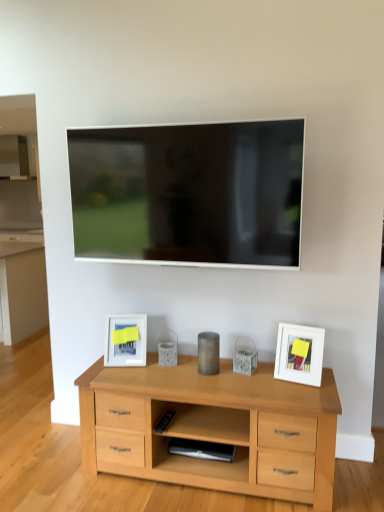
The image size is (384, 512). Identify the location of matte black tv at upper center. (189, 193).

This screenshot has width=384, height=512. Describe the element at coordinates (299, 354) in the screenshot. I see `white matte picture frame at right, the first picture frame when ordered from right to left` at that location.

Locate an element on the screen. satin black speaker at lower center, the 1th appliance when ordered from bottom to top is located at coordinates (202, 449).

I want to click on matte black tv at upper center, so click(189, 193).

How different are the orientations of satin black speaker at lower center, the 2th appliance from the top, and white matte picture frame at lower left, which ranks as the 1th picture frame in left-to-right order, in degrees?

There is a 14.4-degree angle between the facing directions of satin black speaker at lower center, the 2th appliance from the top, and white matte picture frame at lower left, which ranks as the 1th picture frame in left-to-right order.

Is satin black speaker at lower center, the 1th appliance when ordered from bottom to top, oriented towards white matte picture frame at lower left, which ranks as the 1th picture frame in left-to-right order?

No.

Is satin black speaker at lower center, the 2th appliance from the top, shorter than white matte picture frame at lower left, marked as the 2th picture frame in a front-to-back arrangement?

Indeed, satin black speaker at lower center, the 2th appliance from the top, has a lesser height compared to white matte picture frame at lower left, marked as the 2th picture frame in a front-to-back arrangement.

From a real-world perspective, which object stands above the other?

white matte picture frame at lower left, which appears as the first picture frame when viewed from the back, from a real-world perspective.

Considering the sizes of objects white matte picture frame at lower left, the 2th picture frame in the right-to-left sequence, and matte black tv at upper center in the image provided, who is shorter, white matte picture frame at lower left, the 2th picture frame in the right-to-left sequence, or matte black tv at upper center?

white matte picture frame at lower left, the 2th picture frame in the right-to-left sequence.

Between white matte picture frame at lower left, the 2th picture frame in the right-to-left sequence, and matte black tv at upper center, which one appears on the right side from the viewer's perspective?

From the viewer's perspective, matte black tv at upper center appears more on the right side.

From a real-world perspective, is white matte picture frame at lower left, the 2th picture frame in the right-to-left sequence, on top of matte black tv at upper center?

No, from a real-world perspective, white matte picture frame at lower left, the 2th picture frame in the right-to-left sequence, is not on top of matte black tv at upper center.

Is white matte picture frame at lower left, which ranks as the 1th picture frame in left-to-right order, bigger than matte black tv at upper center?

Incorrect, white matte picture frame at lower left, which ranks as the 1th picture frame in left-to-right order, is not larger than matte black tv at upper center.

What's the angular difference between metallic cylinder at center, the first appliance from the top, and matte black tv at upper center's facing directions?

They differ by 4.69 degrees in their facing directions.

Is metallic cylinder at center, the first appliance from the top, positioned before matte black tv at upper center?

No, metallic cylinder at center, the first appliance from the top, is further to the viewer.

Could you tell me if metallic cylinder at center, marked as the second appliance in a bottom-to-top arrangement, is facing matte black tv at upper center?

No, metallic cylinder at center, marked as the second appliance in a bottom-to-top arrangement, does not turn towards matte black tv at upper center.

Considering the points (216, 453) and (197, 187), which point is in front, point (216, 453) or point (197, 187)?

The point (197, 187) is in front.

What's the angular difference between satin black speaker at lower center, the 1th appliance when ordered from bottom to top, and matte black tv at upper center's facing directions?

They differ by 2.42 degrees in their facing directions.

From a real-world perspective, is satin black speaker at lower center, the 2th appliance from the top, positioned under matte black tv at upper center based on gravity?

Yes.

Between point (114, 211) and point (200, 337), which one is positioned in front?

The point (114, 211) is in front.

Is matte black tv at upper center spatially inside metallic cylinder at center, the first appliance from the top, or outside of it?

matte black tv at upper center is not enclosed by metallic cylinder at center, the first appliance from the top.

Is matte black tv at upper center directly adjacent to metallic cylinder at center, the first appliance from the top?

There is a gap between matte black tv at upper center and metallic cylinder at center, the first appliance from the top.

Based on the photo, considering the sizes of objects matte black tv at upper center and metallic cylinder at center, the first appliance from the top, in the image provided, who is smaller, matte black tv at upper center or metallic cylinder at center, the first appliance from the top,?

With smaller size is metallic cylinder at center, the first appliance from the top.

Could you tell me if white matte picture frame at lower left, which appears as the first picture frame when viewed from the back, is facing metallic cylinder at center, marked as the second appliance in a bottom-to-top arrangement?

No, white matte picture frame at lower left, which appears as the first picture frame when viewed from the back, does not turn towards metallic cylinder at center, marked as the second appliance in a bottom-to-top arrangement.

Considering the relative positions of white matte picture frame at lower left, which ranks as the 1th picture frame in left-to-right order, and metallic cylinder at center, the first appliance from the top, in the image provided, is white matte picture frame at lower left, which ranks as the 1th picture frame in left-to-right order, to the left of metallic cylinder at center, the first appliance from the top, from the viewer's perspective?

Indeed, white matte picture frame at lower left, which ranks as the 1th picture frame in left-to-right order, is positioned on the left side of metallic cylinder at center, the first appliance from the top.

Is point (144, 322) positioned behind point (215, 368)?

Yes, point (144, 322) is farther from viewer.

Can you confirm if white matte picture frame at right, marked as the first picture frame in a front-to-back arrangement, is thinner than satin black speaker at lower center, the 2th appliance from the top?

Yes, white matte picture frame at right, marked as the first picture frame in a front-to-back arrangement, is thinner than satin black speaker at lower center, the 2th appliance from the top.

Consider the image. Based on their positions, is white matte picture frame at right, the second picture frame viewed from the left, located to the left or right of satin black speaker at lower center, the 1th appliance when ordered from bottom to top?

Based on their positions, white matte picture frame at right, the second picture frame viewed from the left, is located to the right of satin black speaker at lower center, the 1th appliance when ordered from bottom to top.

Could you tell me if white matte picture frame at right, marked as the first picture frame in a front-to-back arrangement, is turned towards satin black speaker at lower center, the 1th appliance when ordered from bottom to top?

No, white matte picture frame at right, marked as the first picture frame in a front-to-back arrangement, is not facing towards satin black speaker at lower center, the 1th appliance when ordered from bottom to top.

Image resolution: width=384 pixels, height=512 pixels. Find the location of `picture frame on the left of satin black speaker at lower center, the 2th appliance from the top`. picture frame on the left of satin black speaker at lower center, the 2th appliance from the top is located at coordinates (125, 341).

Where is `television that is above the white matte picture frame at lower left, which ranks as the 1th picture frame in left-to-right order (from a real-world perspective)`? The height and width of the screenshot is (512, 384). television that is above the white matte picture frame at lower left, which ranks as the 1th picture frame in left-to-right order (from a real-world perspective) is located at coordinates (189, 193).

From the image, which object appears to be farther from satin black speaker at lower center, the 2th appliance from the top, metallic cylinder at center, marked as the second appliance in a bottom-to-top arrangement, or white matte picture frame at right, marked as the first picture frame in a front-to-back arrangement?

white matte picture frame at right, marked as the first picture frame in a front-to-back arrangement, lies further to satin black speaker at lower center, the 2th appliance from the top, than the other object.

Which object lies nearer to the anchor point white matte picture frame at lower left, marked as the 2th picture frame in a front-to-back arrangement, metallic cylinder at center, the first appliance from the top, or satin black speaker at lower center, the 2th appliance from the top?

metallic cylinder at center, the first appliance from the top.

From the image, which object appears to be farther from metallic cylinder at center, marked as the second appliance in a bottom-to-top arrangement, white matte picture frame at lower left, which appears as the first picture frame when viewed from the back, or white matte picture frame at right, the first picture frame when ordered from right to left?

The object further to metallic cylinder at center, marked as the second appliance in a bottom-to-top arrangement, is white matte picture frame at right, the first picture frame when ordered from right to left.

Consider the image. Based on their spatial positions, is white matte picture frame at lower left, the 2th picture frame in the right-to-left sequence, or metallic cylinder at center, marked as the second appliance in a bottom-to-top arrangement, further from matte black tv at upper center?

Among the two, metallic cylinder at center, marked as the second appliance in a bottom-to-top arrangement, is located further to matte black tv at upper center.

When comparing their distances from metallic cylinder at center, marked as the second appliance in a bottom-to-top arrangement, does white matte picture frame at lower left, the 2th picture frame in the right-to-left sequence, or matte black tv at upper center seem further?

matte black tv at upper center.

Based on their spatial positions, is matte black tv at upper center or satin black speaker at lower center, the 2th appliance from the top, closer to metallic cylinder at center, the first appliance from the top?

Based on the image, satin black speaker at lower center, the 2th appliance from the top, appears to be nearer to metallic cylinder at center, the first appliance from the top.

Based on their spatial positions, is white matte picture frame at lower left, which ranks as the 1th picture frame in left-to-right order, or white matte picture frame at right, the second picture frame viewed from the left, further from satin black speaker at lower center, the 1th appliance when ordered from bottom to top?

Among the two, white matte picture frame at right, the second picture frame viewed from the left, is located further to satin black speaker at lower center, the 1th appliance when ordered from bottom to top.

Estimate the real-world distances between objects in this image. Which object is closer to matte black tv at upper center, white matte picture frame at right, marked as the first picture frame in a front-to-back arrangement, or satin black speaker at lower center, the 1th appliance when ordered from bottom to top?

white matte picture frame at right, marked as the first picture frame in a front-to-back arrangement.

The width and height of the screenshot is (384, 512). Find the location of `appliance that lies between white matte picture frame at right, marked as the first picture frame in a front-to-back arrangement, and satin black speaker at lower center, the 1th appliance when ordered from bottom to top, from top to bottom`. appliance that lies between white matte picture frame at right, marked as the first picture frame in a front-to-back arrangement, and satin black speaker at lower center, the 1th appliance when ordered from bottom to top, from top to bottom is located at coordinates (208, 353).

Locate an element on the screen. The width and height of the screenshot is (384, 512). appliance between white matte picture frame at lower left, which appears as the first picture frame when viewed from the back, and satin black speaker at lower center, the 1th appliance when ordered from bottom to top, vertically is located at coordinates pyautogui.click(x=208, y=353).

Locate an element on the screen. The width and height of the screenshot is (384, 512). appliance that lies between matte black tv at upper center and satin black speaker at lower center, the 1th appliance when ordered from bottom to top, from top to bottom is located at coordinates (208, 353).

Find the location of a particular element. The height and width of the screenshot is (512, 384). television located between white matte picture frame at lower left, the 2th picture frame in the right-to-left sequence, and white matte picture frame at right, the second picture frame when ordered from back to front, in the left-right direction is located at coordinates (189, 193).